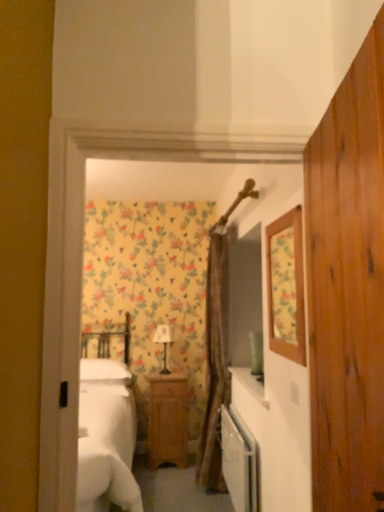
Question: Is the position of floral wallpaper mirror at upper right more distant than that of wooden dresser at center?

Choices:
 (A) no
 (B) yes

Answer: (B)

Question: From a real-world perspective, is floral wallpaper mirror at upper right positioned under wooden dresser at center based on gravity?

Choices:
 (A) yes
 (B) no

Answer: (B)

Question: From the image's perspective, does floral wallpaper mirror at upper right appear higher than wooden dresser at center?

Choices:
 (A) no
 (B) yes

Answer: (B)

Question: Is floral wallpaper mirror at upper right taller than wooden dresser at center?

Choices:
 (A) yes
 (B) no

Answer: (B)

Question: Is floral wallpaper mirror at upper right shorter than wooden dresser at center?

Choices:
 (A) no
 (B) yes

Answer: (B)

Question: Considering the relative sizes of floral wallpaper mirror at upper right and wooden dresser at center in the image provided, is floral wallpaper mirror at upper right bigger than wooden dresser at center?

Choices:
 (A) yes
 (B) no

Answer: (B)

Question: From a real-world perspective, is floral wallpaper mirror at upper right on brown textured curtain at center?

Choices:
 (A) no
 (B) yes

Answer: (B)

Question: Does floral wallpaper mirror at upper right appear on the left side of brown textured curtain at center?

Choices:
 (A) no
 (B) yes

Answer: (A)

Question: Can you confirm if floral wallpaper mirror at upper right is positioned to the right of brown textured curtain at center?

Choices:
 (A) no
 (B) yes

Answer: (B)

Question: Is floral wallpaper mirror at upper right positioned beyond the bounds of brown textured curtain at center?

Choices:
 (A) no
 (B) yes

Answer: (B)

Question: Does floral wallpaper mirror at upper right come behind brown textured curtain at center?

Choices:
 (A) yes
 (B) no

Answer: (B)

Question: From the image's perspective, is floral wallpaper mirror at upper right on top of brown textured curtain at center?

Choices:
 (A) no
 (B) yes

Answer: (B)

Question: Considering the relative positions of matte white lamp at center and brown textured curtain at center in the image provided, is matte white lamp at center behind brown textured curtain at center?

Choices:
 (A) yes
 (B) no

Answer: (A)